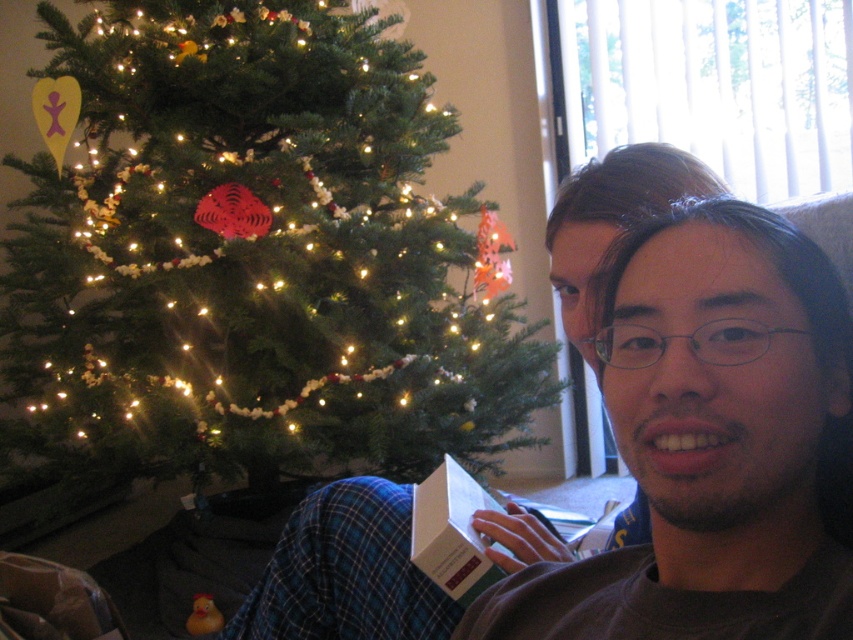
You are a guest at a Christmas party and see the green matte christmas tree at center and the matte brown box at lower center. Which object is closer to you?

The green matte christmas tree at center is closer to you than the matte brown box at lower center.

You are a delivery person who just arrived at the house. You need to place a new gift that is 1 foot wide between the green matte christmas tree at center and the matte brown box at lower center. Is there enough space between them to fit the gift?

The distance between the green matte christmas tree at center and the matte brown box at lower center is 3.60 feet. Since the gift is 1 foot wide, there is sufficient space to place it between them.

You are standing in the room where the green matte christmas tree at center is located. If you face the tree and look directly ahead, where would you expect to find the tree relative to your position?

The green matte christmas tree at center is located at the center of the room, so facing it directly would mean it is right in front of you at the center point.